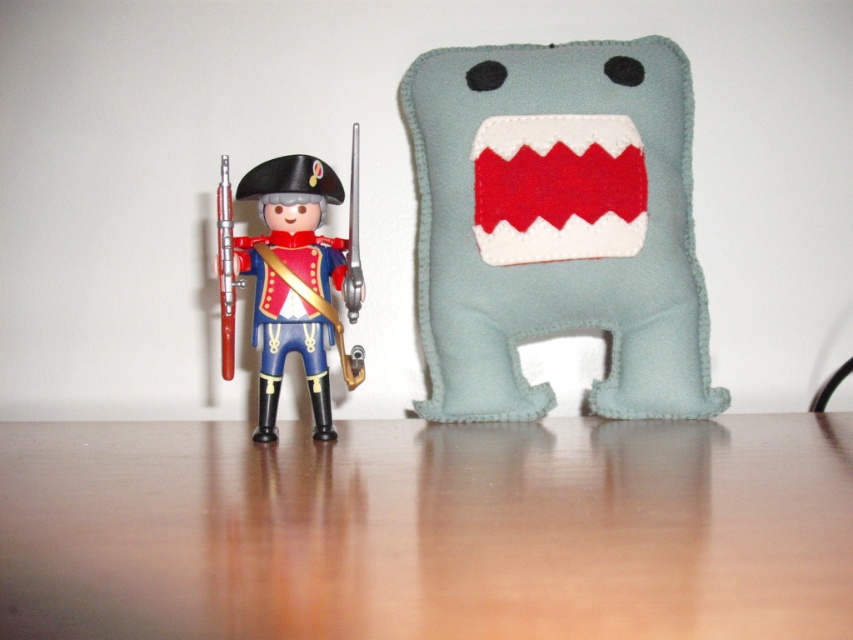
You are setting up a display on the wooden table at center and need to place the shiny plastic soldier at left on it. Considering the height of the table, will the soldier be able to stand upright without falling over?

The wooden table at center is not as tall as the shiny plastic soldier at left, so the soldier will be taller than the table and might tip over if not placed carefully.

You are standing in front of the wooden surface with two objects. You want to pick up the object closer to you. Which point should you reach for, point at point (131, 554) or point at point (271, 189)?

You should reach for point at point (131, 554) because it is closer to the viewer than point at point (271, 189).

You are an AI that needs to determine the position of objects in an image. Given the coordinates provided, can you state the exact 2D coordinates of the light blue felt plush at right?

The light blue felt plush at right is located at the 2D coordinates of point (x=556, y=225).